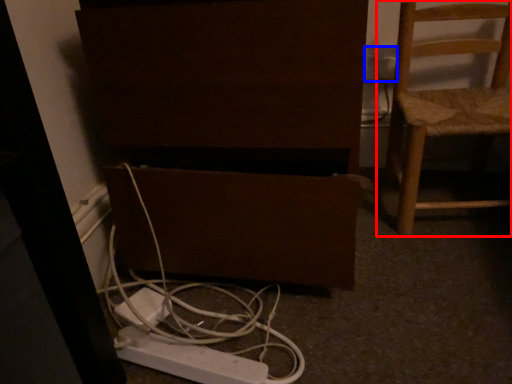
Question: Which of the following is the closest to the observer, chair (highlighted by a red box) or electric outlet (highlighted by a blue box)?

Choices:
 (A) chair
 (B) electric outlet

Answer: (A)